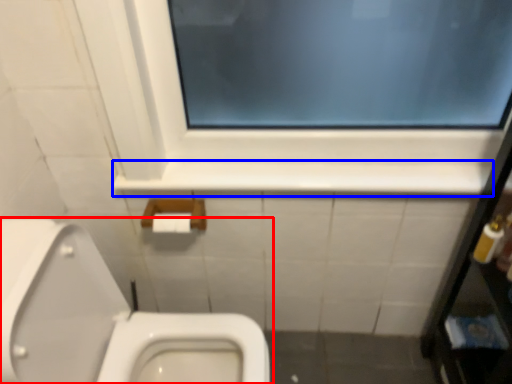
Question: Which object appears farthest to the camera in this image, toilet (highlighted by a red box) or ledge (highlighted by a blue box)?

Choices:
 (A) toilet
 (B) ledge

Answer: (B)